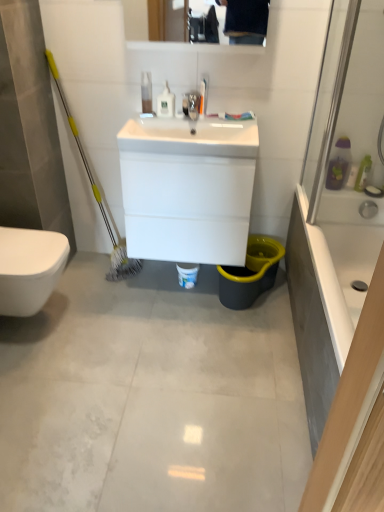
Question: Would you say gray tile floor at center is outside white glossy sink at center, the 2th sink in the bottom-to-top sequence?

Choices:
 (A) no
 (B) yes

Answer: (B)

Question: Can you confirm if gray tile floor at center is smaller than white glossy sink at center, the 2th sink in the bottom-to-top sequence?

Choices:
 (A) yes
 (B) no

Answer: (B)

Question: Is the depth of gray tile floor at center less than that of white glossy sink at center, which is the first sink from top to bottom?

Choices:
 (A) no
 (B) yes

Answer: (B)

Question: From a real-world perspective, is gray tile floor at center under white glossy sink at center, the 2th sink in the bottom-to-top sequence?

Choices:
 (A) yes
 (B) no

Answer: (A)

Question: Does gray tile floor at center have a greater height compared to white glossy sink at center, which is the first sink from top to bottom?

Choices:
 (A) yes
 (B) no

Answer: (B)

Question: Is point coord(165,91) positioned closer to the camera than point coord(192,132)?

Choices:
 (A) closer
 (B) farther

Answer: (A)

Question: From a real-world perspective, is white glossy bottle at upper center, the 2th toiletry in the left-to-right sequence, physically located above or below white glossy sink at center, which is the first sink from top to bottom?

Choices:
 (A) above
 (B) below

Answer: (A)

Question: In terms of size, does white glossy bottle at upper center, the 2th toiletry in the left-to-right sequence, appear bigger or smaller than white glossy sink at center, the 2th sink in the bottom-to-top sequence?

Choices:
 (A) big
 (B) small

Answer: (B)

Question: Visually, is white glossy bottle at upper center, the second toiletry positioned from the right, positioned to the left or to the right of white glossy sink at center, which is the first sink from top to bottom?

Choices:
 (A) left
 (B) right

Answer: (A)

Question: Is white glossy bidet at lower left situated inside white glossy bottle at upper center, the second toiletry positioned from the right, or outside?

Choices:
 (A) outside
 (B) inside

Answer: (A)

Question: In terms of size, does white glossy bidet at lower left appear bigger or smaller than white glossy bottle at upper center, the 2th toiletry in the left-to-right sequence?

Choices:
 (A) big
 (B) small

Answer: (A)

Question: From their relative heights in the image, would you say white glossy bidet at lower left is taller or shorter than white glossy bottle at upper center, which is the 2th toiletry from top to bottom?

Choices:
 (A) tall
 (B) short

Answer: (A)

Question: Considering their positions, is white glossy bidet at lower left located in front of or behind white glossy bottle at upper center, the second toiletry positioned from the right?

Choices:
 (A) behind
 (B) front

Answer: (B)

Question: Do you think translucent plastic toothbrush at upper right, the first toiletry when ordered from right to left, is within white glossy bidet at lower left, or outside of it?

Choices:
 (A) inside
 (B) outside

Answer: (B)

Question: Looking at the image, does translucent plastic toothbrush at upper right, the first toiletry when ordered from bottom to top, seem bigger or smaller compared to white glossy bidet at lower left?

Choices:
 (A) big
 (B) small

Answer: (B)